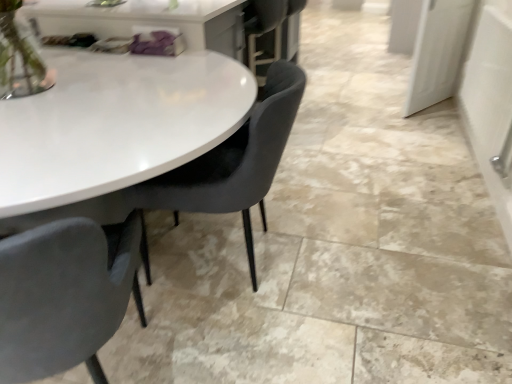
Image resolution: width=512 pixels, height=384 pixels. In order to click on velvet grey chair at center, the first chair when ordered from left to right in this screenshot , I will do `click(65, 295)`.

I want to click on matte black chair at center, placed as the first chair when sorted from right to left, so click(234, 161).

Between point (453, 41) and point (7, 366), which one is positioned in front?

Positioned in front is point (7, 366).

Is velvet grey chair at center, the first chair when ordered from left to right, a part of white glossy door at upper right?

That's incorrect, velvet grey chair at center, the first chair when ordered from left to right, is not inside white glossy door at upper right.

From a real-world perspective, between white glossy door at upper right and velvet grey chair at center, which is the 2th chair from right to left, who is vertically lower?

velvet grey chair at center, which is the 2th chair from right to left, from a real-world perspective.

Is white glossy door at upper right next to velvet grey chair at center, the first chair when ordered from left to right?

Result: white glossy door at upper right and velvet grey chair at center, the first chair when ordered from left to right, are clearly separated.

How much distance is there between matte black chair at center, acting as the 2th chair starting from the left, and velvet grey chair at center, the first chair when ordered from left to right?

matte black chair at center, acting as the 2th chair starting from the left, is 20.11 inches away from velvet grey chair at center, the first chair when ordered from left to right.

Is matte black chair at center, acting as the 2th chair starting from the left, at the right side of velvet grey chair at center, which is the 2th chair from right to left?

Correct, you'll find matte black chair at center, acting as the 2th chair starting from the left, to the right of velvet grey chair at center, which is the 2th chair from right to left.

Is matte black chair at center, acting as the 2th chair starting from the left, next to velvet grey chair at center, which is the 2th chair from right to left, and touching it?

No, matte black chair at center, acting as the 2th chair starting from the left, is not with velvet grey chair at center, which is the 2th chair from right to left.

From a real-world perspective, is matte black chair at center, acting as the 2th chair starting from the left, positioned over velvet grey chair at center, the first chair when ordered from left to right, based on gravity?

No.

From the white glossy door at upper right, count 1st chairs forward and point to it. Please provide its 2D coordinates.

[(234, 161)]

Between white glossy door at upper right and matte black chair at center, placed as the first chair when sorted from right to left, which one appears on the right side from the viewer's perspective?

white glossy door at upper right.

Which is more distant, (439, 51) or (262, 107)?

Point (439, 51)

Could you tell me if white glossy door at upper right is facing matte black chair at center, placed as the first chair when sorted from right to left?

No, white glossy door at upper right is not turned towards matte black chair at center, placed as the first chair when sorted from right to left.

From the white glossy door at upper right, count the 2nd chair to the left and point to it. Please provide its 2D coordinates.

[(65, 295)]

From the picture: From a real-world perspective, is velvet grey chair at center, the first chair when ordered from left to right, physically located above or below white glossy door at upper right?

From a real-world perspective, velvet grey chair at center, the first chair when ordered from left to right, is physically below white glossy door at upper right.

Considering the sizes of velvet grey chair at center, which is the 2th chair from right to left, and white glossy door at upper right in the image, is velvet grey chair at center, which is the 2th chair from right to left, wider or thinner than white glossy door at upper right?

Considering their sizes, velvet grey chair at center, which is the 2th chair from right to left, looks broader than white glossy door at upper right.

Is velvet grey chair at center, the first chair when ordered from left to right, far from white glossy door at upper right?

Indeed, velvet grey chair at center, the first chair when ordered from left to right, is not near white glossy door at upper right.

Considering the sizes of objects velvet grey chair at center, the first chair when ordered from left to right, and matte black chair at center, placed as the first chair when sorted from right to left, in the image provided, who is wider, velvet grey chair at center, the first chair when ordered from left to right, or matte black chair at center, placed as the first chair when sorted from right to left,?

matte black chair at center, placed as the first chair when sorted from right to left.

At what (x,y) coordinates should I click in order to perform the action: click on chair above the velvet grey chair at center, which is the 2th chair from right to left (from the image's perspective). Please return your answer as a coordinate pair (x, y). The height and width of the screenshot is (384, 512). Looking at the image, I should click on (234, 161).

Consider the image. Is velvet grey chair at center, which is the 2th chair from right to left, directly adjacent to matte black chair at center, placed as the first chair when sorted from right to left?

No, velvet grey chair at center, which is the 2th chair from right to left, is not with matte black chair at center, placed as the first chair when sorted from right to left.

Looking at this image, from the image's perspective, is velvet grey chair at center, the first chair when ordered from left to right, beneath matte black chair at center, placed as the first chair when sorted from right to left?

Yes.

Between matte black chair at center, acting as the 2th chair starting from the left, and white glossy door at upper right, which one has more height?

With more height is white glossy door at upper right.

Relative to white glossy door at upper right, is matte black chair at center, placed as the first chair when sorted from right to left, in front or behind?

matte black chair at center, placed as the first chair when sorted from right to left, is in front of white glossy door at upper right.

Consider the image. Is white glossy door at upper right located within matte black chair at center, acting as the 2th chair starting from the left?

No, matte black chair at center, acting as the 2th chair starting from the left, does not contain white glossy door at upper right.

There is a white glossy door at upper right. Where is `the 1st chair below it (from a real-world perspective)`? the 1st chair below it (from a real-world perspective) is located at coordinates (65, 295).

Identify the location of chair above the matte black chair at center, acting as the 2th chair starting from the left (from a real-world perspective). This screenshot has width=512, height=384. (65, 295).

When comparing their distances from matte black chair at center, placed as the first chair when sorted from right to left, does velvet grey chair at center, which is the 2th chair from right to left, or white glossy door at upper right seem closer?

velvet grey chair at center, which is the 2th chair from right to left, is closer to matte black chair at center, placed as the first chair when sorted from right to left.

In the scene shown: Based on their spatial positions, is velvet grey chair at center, which is the 2th chair from right to left, or matte black chair at center, acting as the 2th chair starting from the left, further from white glossy door at upper right?

velvet grey chair at center, which is the 2th chair from right to left, lies further to white glossy door at upper right than the other object.

Estimate the real-world distances between objects in this image. Which object is further from velvet grey chair at center, the first chair when ordered from left to right, matte black chair at center, placed as the first chair when sorted from right to left, or white glossy door at upper right?

white glossy door at upper right lies further to velvet grey chair at center, the first chair when ordered from left to right, than the other object.

Looking at this image, considering their positions, is matte black chair at center, acting as the 2th chair starting from the left, positioned further to white glossy door at upper right than velvet grey chair at center, the first chair when ordered from left to right?

The object further to white glossy door at upper right is velvet grey chair at center, the first chair when ordered from left to right.

From the image, which object appears to be farther from velvet grey chair at center, which is the 2th chair from right to left, white glossy door at upper right or matte black chair at center, placed as the first chair when sorted from right to left?

white glossy door at upper right lies further to velvet grey chair at center, which is the 2th chair from right to left, than the other object.

Consider the image. Considering their positions, is white glossy door at upper right positioned closer to matte black chair at center, acting as the 2th chair starting from the left, than velvet grey chair at center, which is the 2th chair from right to left?

Among the two, velvet grey chair at center, which is the 2th chair from right to left, is located nearer to matte black chair at center, acting as the 2th chair starting from the left.

Locate an element on the screen. This screenshot has height=384, width=512. chair between velvet grey chair at center, the first chair when ordered from left to right, and white glossy door at upper right, along the z-axis is located at coordinates (234, 161).